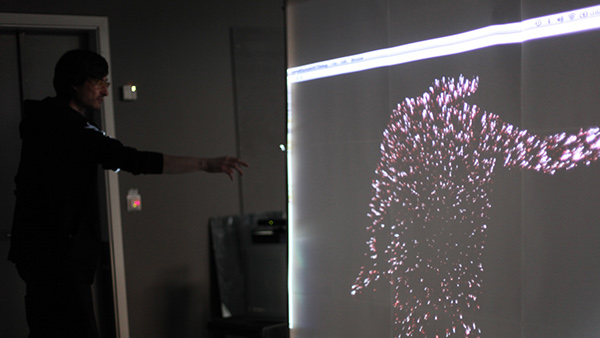
In order to click on wall in this screenshot , I will do `click(177, 77)`.